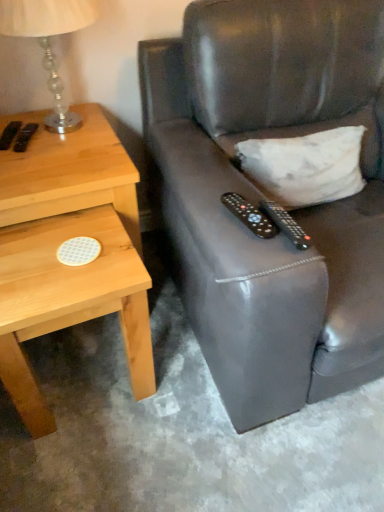
Find the location of a particular element. This screenshot has height=512, width=384. vacant space underneath translucent glass lamp at upper left (from a real-world perspective) is located at coordinates pyautogui.click(x=66, y=133).